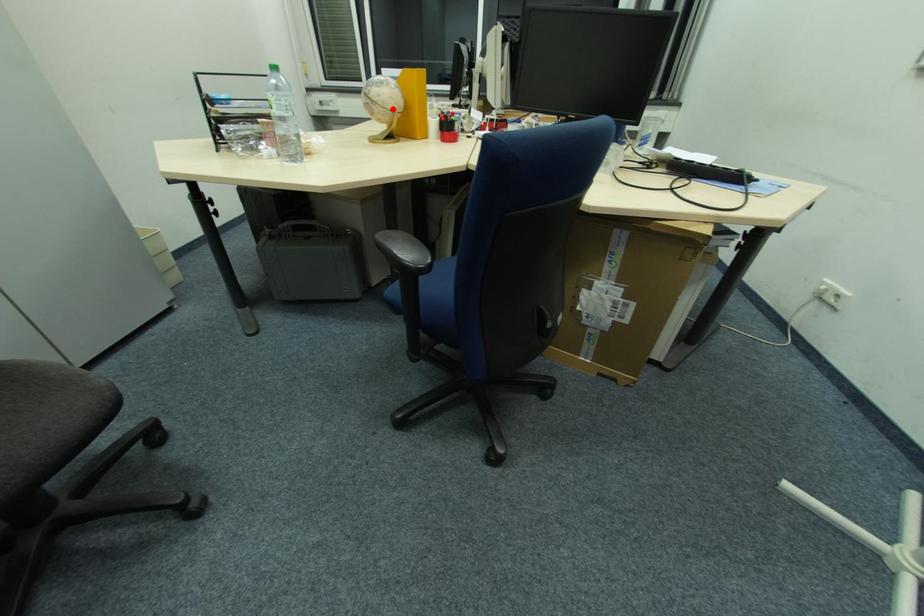
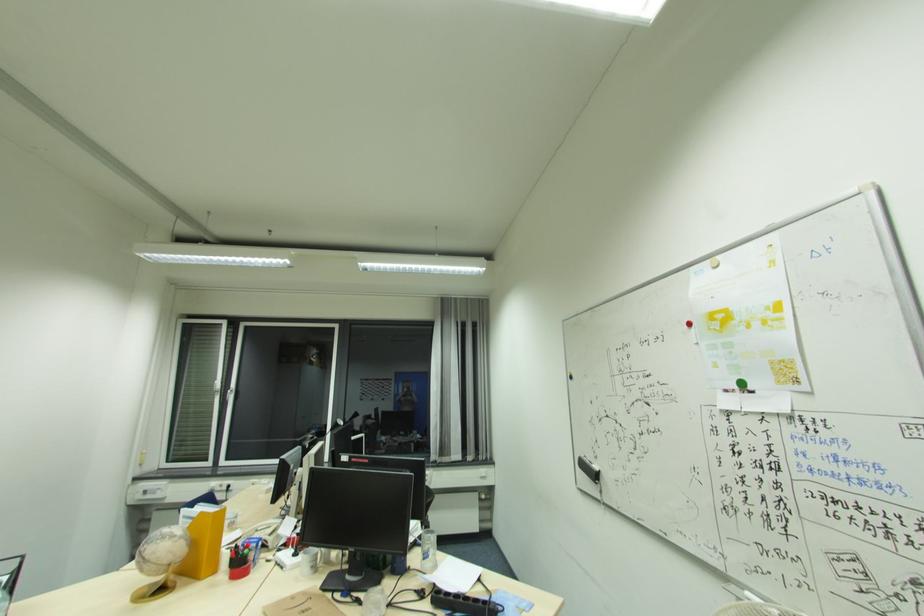
Where in the second image is the point corresponding to the highlighted location from the first image?

(167, 564)